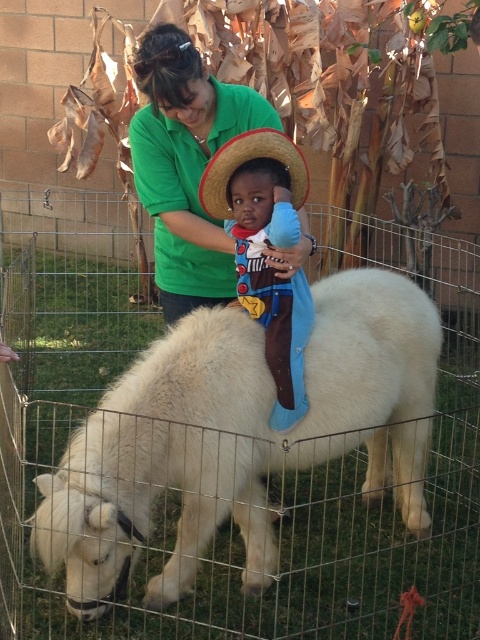
Question: Which object appears closest to the camera in this image?

Choices:
 (A) strawmaterial/texturehat at upper center
 (B) green cotton shirt at upper center

Answer: (A)

Question: Which of the following is the closest to the observer?

Choices:
 (A) (172, 276)
 (B) (78, 532)

Answer: (B)

Question: Among these points, which one is nearest to the camera?

Choices:
 (A) (141, 435)
 (B) (248, 160)
 (C) (187, 192)

Answer: (B)

Question: Does green cotton shirt at upper center have a lesser width compared to strawmaterial/texturehat at upper center?

Choices:
 (A) yes
 (B) no

Answer: (B)

Question: Can you confirm if green cotton shirt at upper center is wider than strawmaterial/texturehat at upper center?

Choices:
 (A) yes
 (B) no

Answer: (A)

Question: Considering the relative positions of white fluffy pony at center and strawmaterial/texturehat at upper center in the image provided, where is white fluffy pony at center located with respect to strawmaterial/texturehat at upper center?

Choices:
 (A) above
 (B) below

Answer: (B)